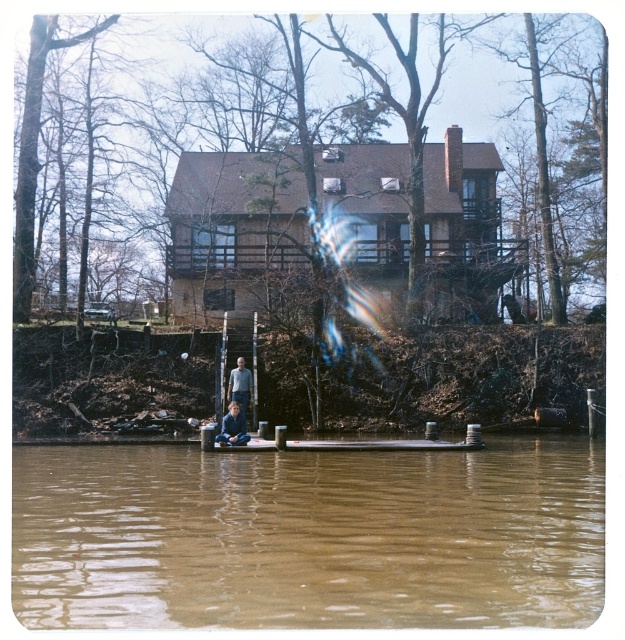
Does brown muddy water at lower center have a larger size compared to light blue jeans at lower center?

Yes, brown muddy water at lower center is bigger than light blue jeans at lower center.

Is brown muddy water at lower center above light blue jeans at lower center?

No, brown muddy water at lower center is not above light blue jeans at lower center.

The height and width of the screenshot is (640, 625). In order to click on brown muddy water at lower center in this screenshot , I will do point(308,536).

Which of these two, brown muddy water at lower center or dark blue sweater at center, stands taller?

With more height is dark blue sweater at center.

From the picture: Does brown muddy water at lower center appear on the right side of dark blue sweater at center?

Indeed, brown muddy water at lower center is positioned on the right side of dark blue sweater at center.

Which is behind, point (301, 582) or point (241, 436)?

The point (241, 436) is more distant.

The image size is (625, 640). I want to click on brown muddy water at lower center, so click(x=308, y=536).

Does dark blue sweater at center appear on the left side of light blue jeans at lower center?

No, dark blue sweater at center is not to the left of light blue jeans at lower center.

Can you confirm if dark blue sweater at center is thinner than light blue jeans at lower center?

Incorrect, dark blue sweater at center's width is not less than light blue jeans at lower center's.

Is point (241, 417) behind point (231, 384)?

That is False.

The height and width of the screenshot is (640, 625). In order to click on dark blue sweater at center in this screenshot , I will do `click(232, 426)`.